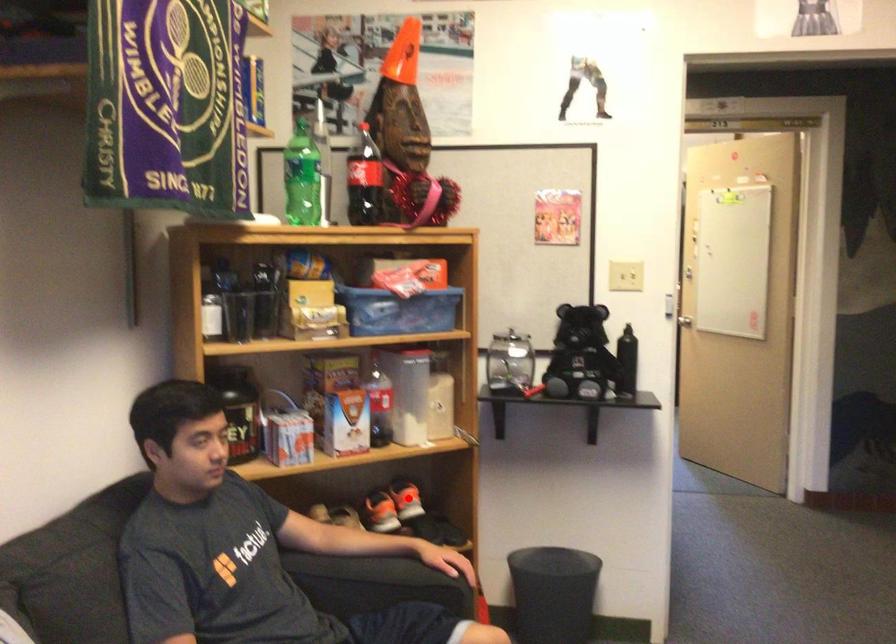
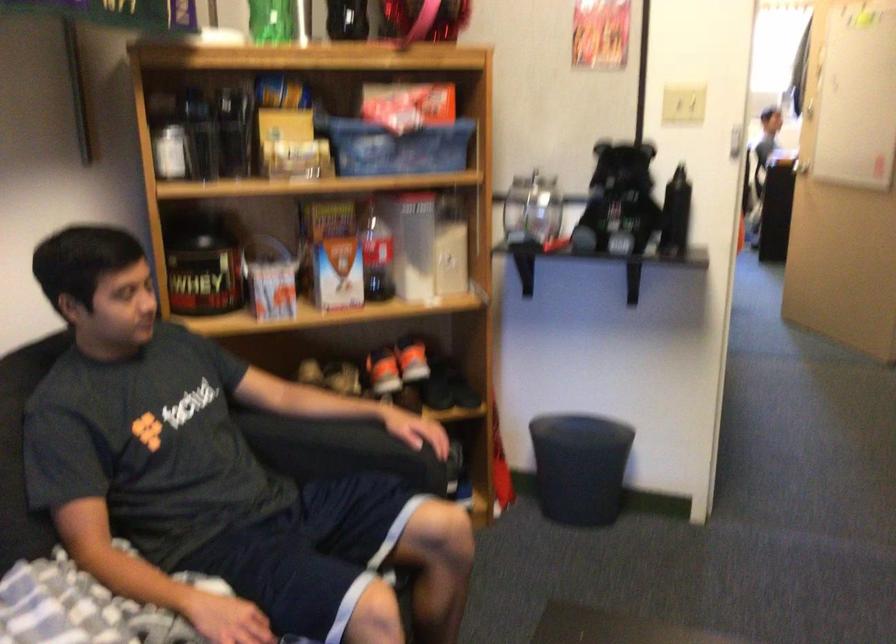
Question: I am providing you with two images of the same scene from different viewpoints. A red point is marked on the first image. At the location where the point appears in image 1, is it still visible in image 2?

Choices:
 (A) Yes
 (B) No

Answer: (A)